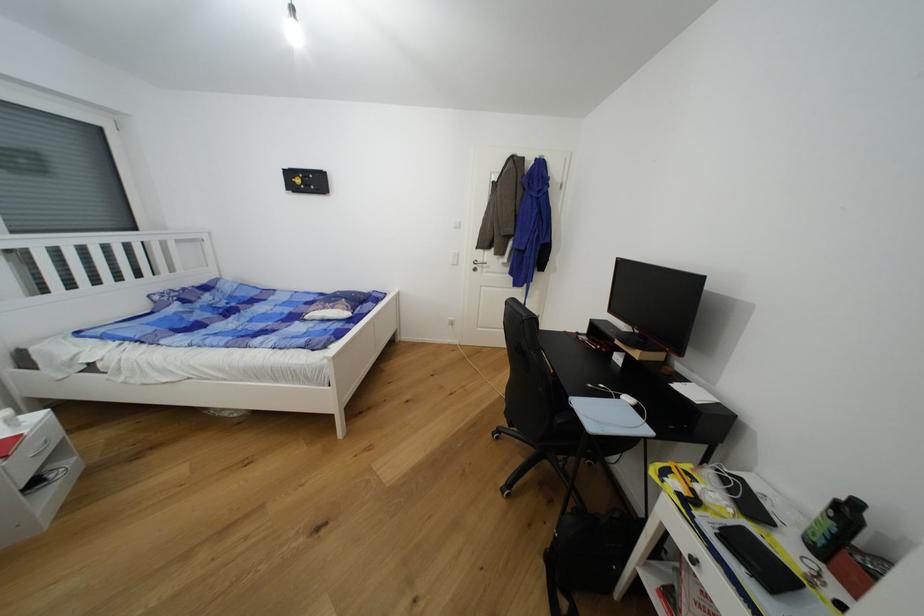
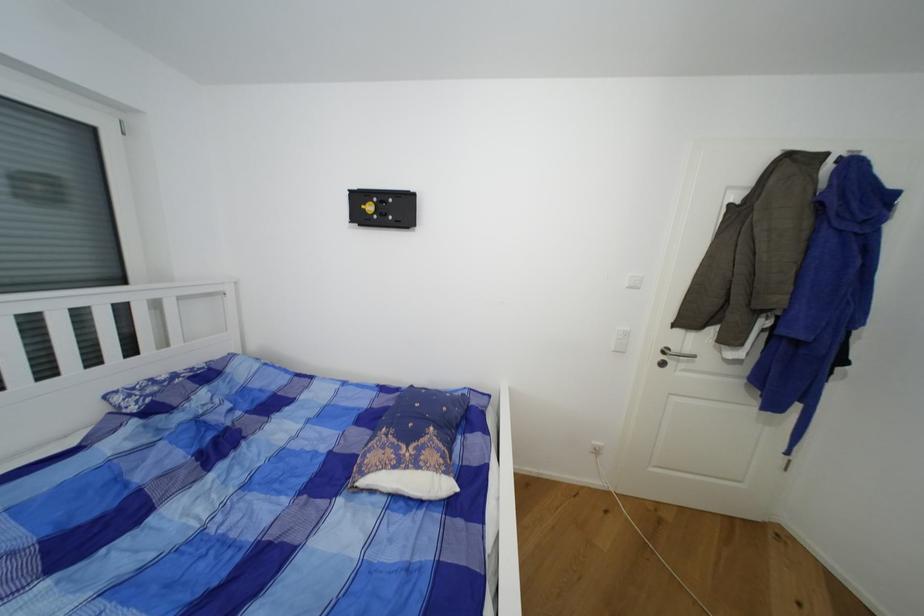
Find the pixel in the second image that matches point (490, 262) in the first image.

(691, 352)